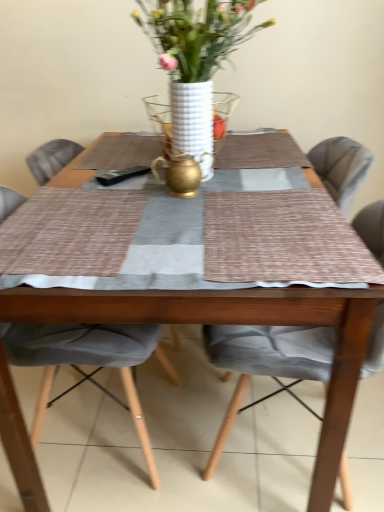
Question: Which direction should I rotate to look at gray fabric chair at center, the 2th chair in the right-to-left sequence, — up or down?

Choices:
 (A) down
 (B) up

Answer: (A)

Question: From the image's perspective, does gray fabric chair at center, placed as the 1th chair when sorted from left to right, appear higher than wooden table at center?

Choices:
 (A) yes
 (B) no

Answer: (B)

Question: Can you confirm if gray fabric chair at center, placed as the 1th chair when sorted from left to right, is shorter than wooden table at center?

Choices:
 (A) no
 (B) yes

Answer: (A)

Question: Can you confirm if gray fabric chair at center, placed as the 1th chair when sorted from left to right, is smaller than wooden table at center?

Choices:
 (A) yes
 (B) no

Answer: (A)

Question: Are gray fabric chair at center, placed as the 1th chair when sorted from left to right, and wooden table at center making contact?

Choices:
 (A) yes
 (B) no

Answer: (B)

Question: Is the position of gray fabric chair at center, the 2th chair in the right-to-left sequence, more distant than that of wooden table at center?

Choices:
 (A) yes
 (B) no

Answer: (A)

Question: Considering the relative sizes of gray fabric chair at center, the 2th chair in the right-to-left sequence, and wooden table at center in the image provided, is gray fabric chair at center, the 2th chair in the right-to-left sequence, wider than wooden table at center?

Choices:
 (A) yes
 (B) no

Answer: (B)

Question: Does white ceramic vase at center have a smaller size compared to gray fabric chair at center, the 2th chair in the right-to-left sequence?

Choices:
 (A) yes
 (B) no

Answer: (A)

Question: From a real-world perspective, is white ceramic vase at center below gray fabric chair at center, placed as the 1th chair when sorted from left to right?

Choices:
 (A) yes
 (B) no

Answer: (B)

Question: Does white ceramic vase at center come in front of gray fabric chair at center, the 2th chair in the right-to-left sequence?

Choices:
 (A) no
 (B) yes

Answer: (B)

Question: Is white ceramic vase at center further to camera compared to gray fabric chair at center, placed as the 1th chair when sorted from left to right?

Choices:
 (A) yes
 (B) no

Answer: (B)

Question: Does white ceramic vase at center turn towards gray fabric chair at center, the 2th chair in the right-to-left sequence?

Choices:
 (A) yes
 (B) no

Answer: (B)

Question: From a real-world perspective, is white ceramic vase at center positioned over gray fabric chair at center, the 2th chair in the right-to-left sequence, based on gravity?

Choices:
 (A) yes
 (B) no

Answer: (A)

Question: Are wooden table at center and white ceramic vase at center making contact?

Choices:
 (A) no
 (B) yes

Answer: (A)